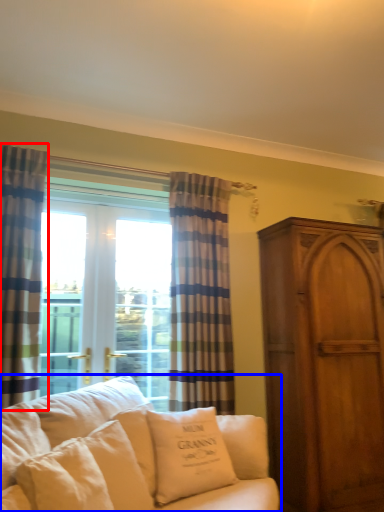
Question: Which object appears farthest to the camera in this image, curtain (highlighted by a red box) or studio couch (highlighted by a blue box)?

Choices:
 (A) curtain
 (B) studio couch

Answer: (A)